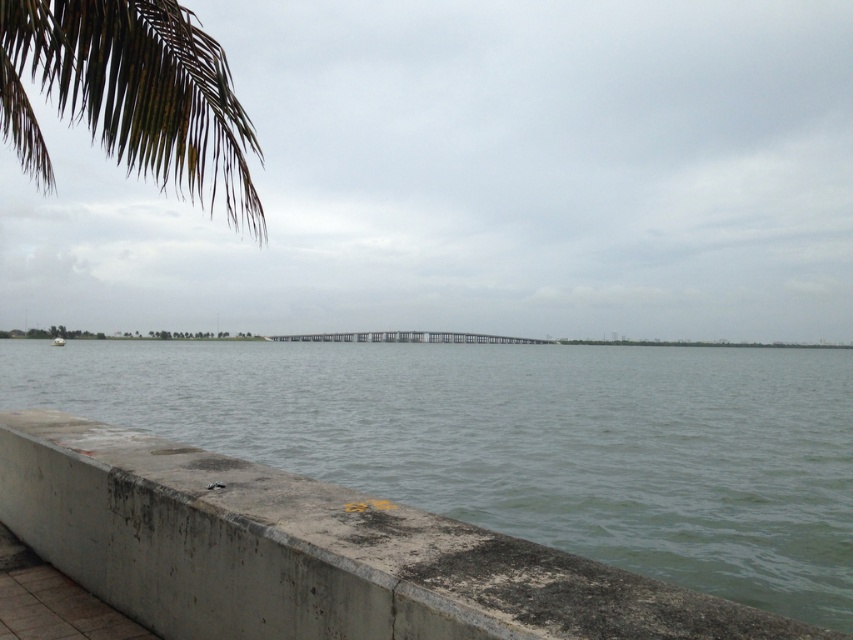
Based on the photo, you are a photographer standing at the waterfront. You want to capture a photo where the gray concrete water at center and the gray metallic rail at center are both visible. Which object will appear taller in the photo?

The gray concrete water at center will appear taller in the photo because it has a greater height compared to the gray metallic rail at center.

You are standing at the waterfront and want to take a photo of the gray concrete water at center and the gray metallic rail at center. Which object should you focus on first to ensure both are in sharp focus?

You should focus on the gray metallic rail at center first because it is farther away from the viewer than the gray concrete water at center. By focusing on the farther object, you can ensure both are within the depth of field and in sharp focus.

You are standing at the waterfront and see the dark green leafy palm tree at upper left and the gray metallic rail at center. Which object is positioned to the left of the other?

The dark green leafy palm tree at upper left is to the left of the gray metallic rail at center.